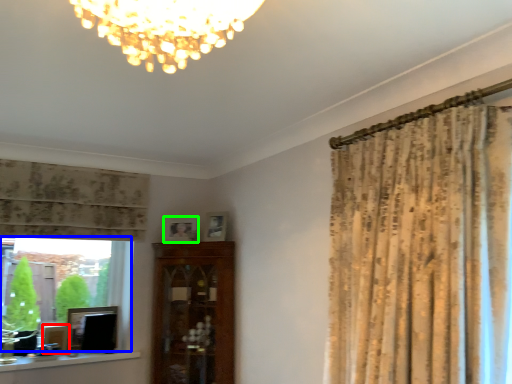
Question: Estimate the real-world distances between objects in this image. Which object is closer to picture frame (highlighted by a red box), bay window (highlighted by a blue box) or picture frame (highlighted by a green box)?

Choices:
 (A) bay window
 (B) picture frame

Answer: (A)